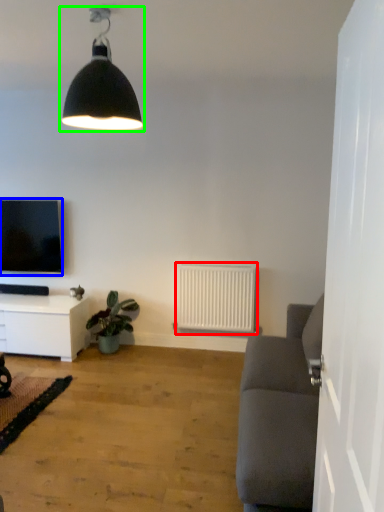
Question: Which object is positioned closest to radiator (highlighted by a red box)? Select from television (highlighted by a blue box) and lamp (highlighted by a green box).

Choices:
 (A) television
 (B) lamp

Answer: (A)